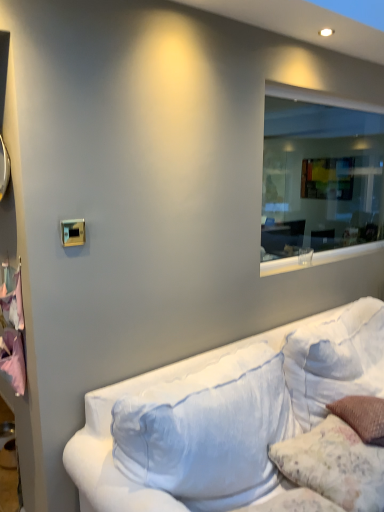
Question: From the image's perspective, is transparent glass window at upper right positioned above or below fluffy white pillow at lower right?

Choices:
 (A) below
 (B) above

Answer: (B)

Question: In terms of width, does transparent glass window at upper right look wider or thinner when compared to fluffy white pillow at lower right?

Choices:
 (A) thin
 (B) wide

Answer: (A)

Question: Which of these objects is positioned farthest from the pink fabric at left?

Choices:
 (A) fluffy white pillow at lower right
 (B) transparent glass window at upper right
 (C) white fabric couch at lower right

Answer: (B)

Question: Which object is positioned closest to the fluffy white pillow at lower right?

Choices:
 (A) transparent glass window at upper right
 (B) white fabric couch at lower right
 (C) pink fabric at left

Answer: (B)